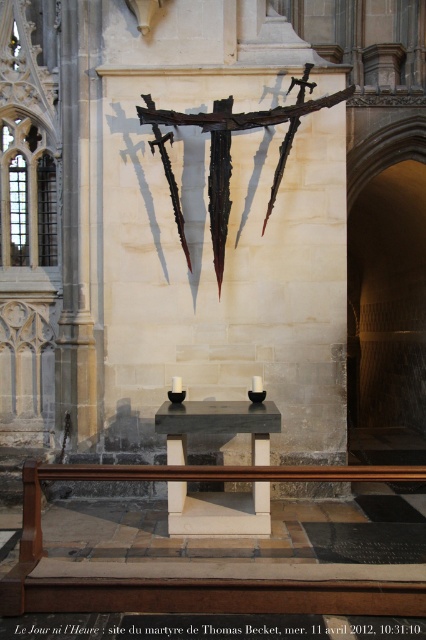
In the scene shown: You are standing in the cathedral and want to place a bouquet of white roses on the black polished stone altar at center. Based on the coordinates provided, can you determine the exact position where you should place the bouquet?

The black polished stone altar at center is located at coordinates point [218,424], so you should place the bouquet of white roses at that exact position.

You are an art curator planning to move the black polished stone altar at center closer to the entrance. However, you must ensure it remains visible from the rusty metal crucifix at upper center. Based on their current positions, is this possible?

The black polished stone altar at center is located below the rusty metal crucifix at upper center. Since the altar is directly beneath the crucifix, moving it closer to the entrance would likely place it out of the crucifixes line of sight, making it no longer visible from there. Therefore, this adjustment may not be feasible without compromising visibility.